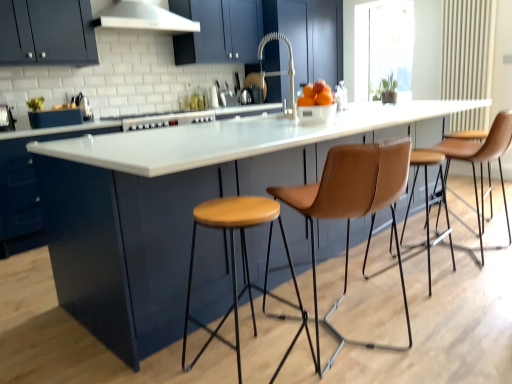
Locate an element on the screen. The image size is (512, 384). vacant area on the back side of tan leather stool at center, the first chair viewed from the left is located at coordinates (333, 283).